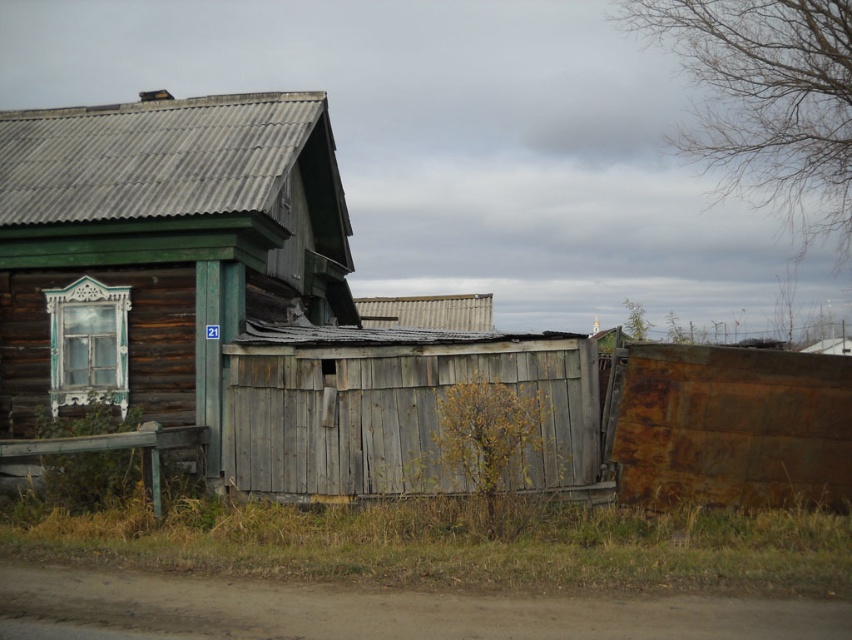
You are a painter who needs to decide which object to paint first. Given that the weathered wood hut at upper left and the rusty metal fence at right are both in need of painting, which one requires more paint based on their size?

The weathered wood hut at upper left requires more paint because its width is larger than the rusty metal fence at right, meaning it has a greater surface area to cover.

You are standing at the entrance of the weathered wooden house with the small blue sign. You want to walk to the point marked by the coordinates point (x=160, y=248). Which direction should you head relative to the house?

The point (x=160, y=248) is marked as the weathered wood hut at upper left. Since you are at the entrance of the house, you should head towards the upper left direction to reach the marked point.

In the scene shown: You are a painter planning to paint both the weathered wood hut at upper left and the rusty metal fence at right. Since you have limited paint, you need to know which object requires more paint. Which one needs more paint?

The weathered wood hut at upper left requires more paint because it is bigger than the rusty metal fence at right.